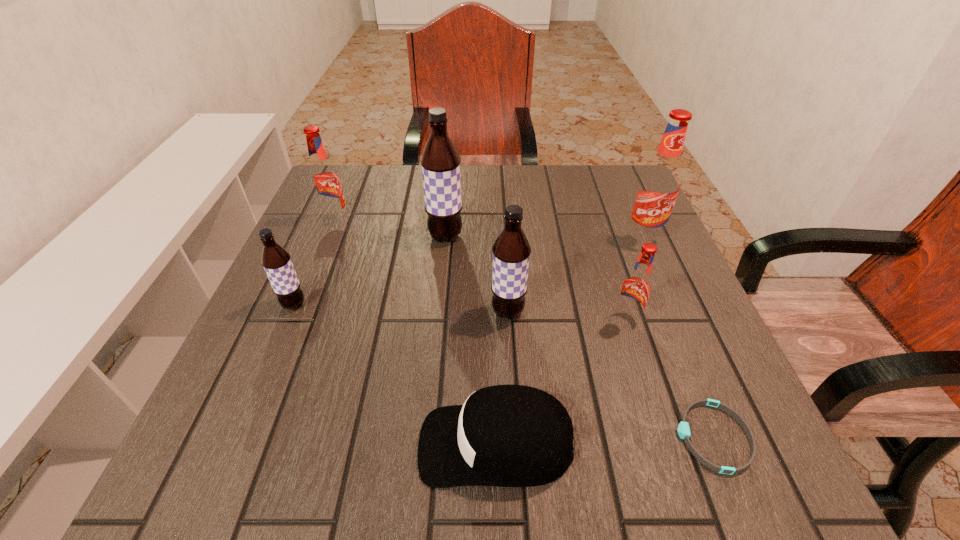
In order to click on vacant point located 0.270m on the front-facing side of the cap in this screenshot , I will do `click(239, 444)`.

Locate an element on the screen. The image size is (960, 540). vacant space located 0.170m on the front-facing side of the cap is located at coordinates (305, 444).

Find the location of a particular element. The width and height of the screenshot is (960, 540). free space located 0.330m on the front-facing side of the cap is located at coordinates (199, 444).

The height and width of the screenshot is (540, 960). I want to click on free point located 0.210m on the buckle of the wristband, so click(540, 437).

Where is `vacant area situated 0.210m on the buckle of the wristband`? The height and width of the screenshot is (540, 960). vacant area situated 0.210m on the buckle of the wristband is located at coordinates (540, 437).

Locate an element on the screen. vacant space located on the buckle of the wristband is located at coordinates (480, 437).

At what (x,y) coordinates should I click in order to perform the action: click on object located at the far edge. Please return your answer as a coordinate pair (x, y). Image resolution: width=960 pixels, height=540 pixels. Looking at the image, I should click on (324, 180).

Where is `cap that is at the near edge`? Image resolution: width=960 pixels, height=540 pixels. cap that is at the near edge is located at coordinates (505, 435).

The image size is (960, 540). I want to click on wristband located at the near edge, so click(x=683, y=429).

Locate an element on the screen. The width and height of the screenshot is (960, 540). wristband located in the right edge section of the desktop is located at coordinates (683, 429).